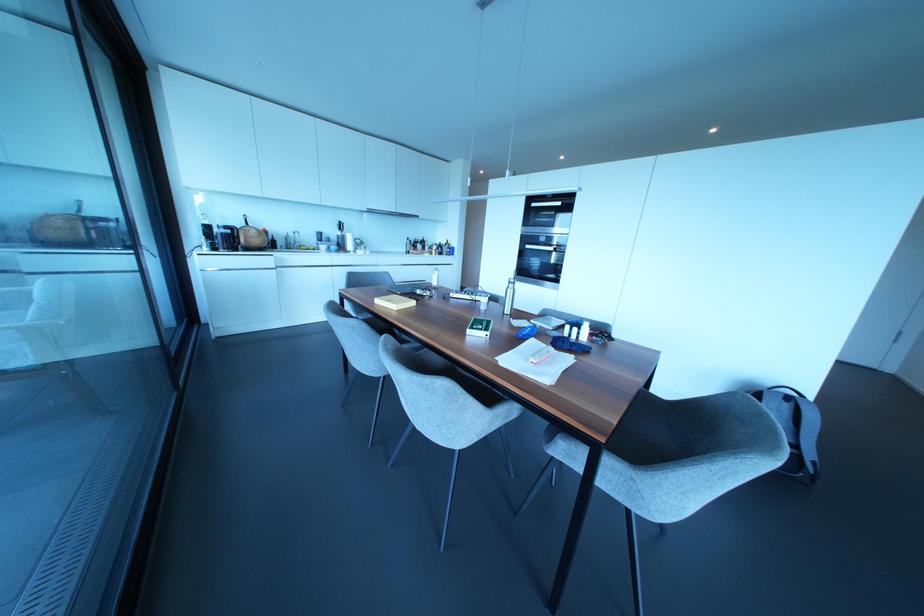
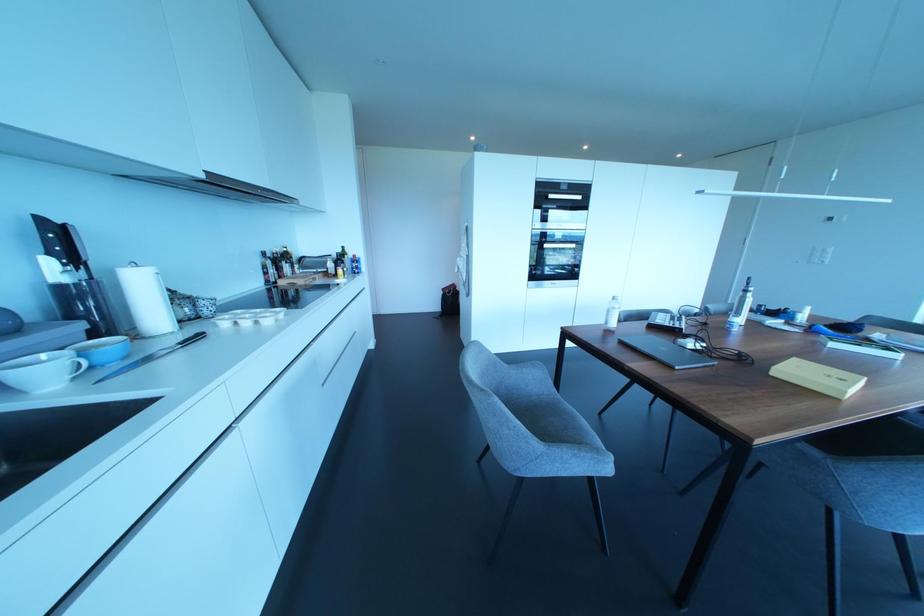
Locate, in the second image, the point that corresponds to pixel 553 248 in the first image.

(573, 246)